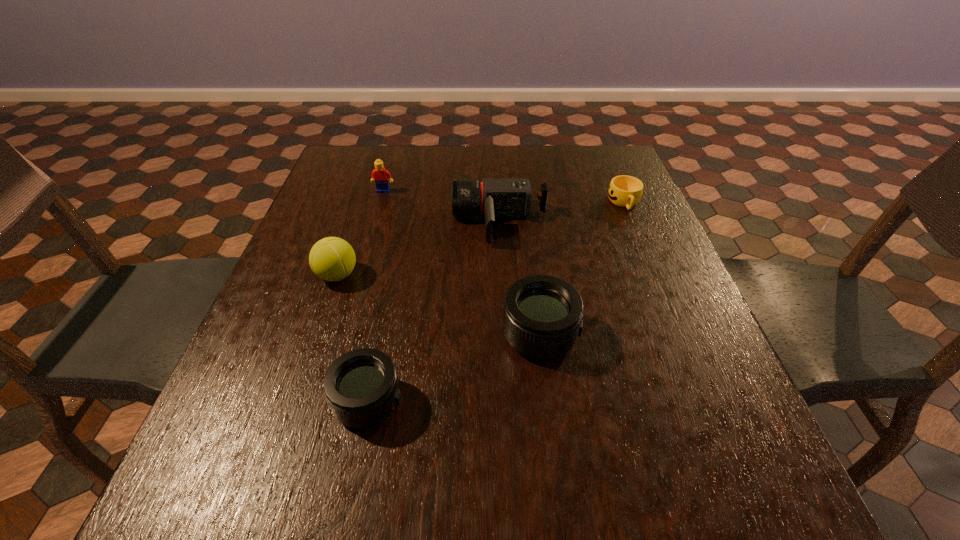
You are a GUI agent. You are given a task and a screenshot of the screen. Output one action in this format:
    pyautogui.click(x=<x>, y=<y>)
    Task: Click on the free location that satisfies the following two spatial constraints: 1. on the face of the rightmost object; 2. on the right side of the Lego
    
    Given the screenshot: What is the action you would take?
    pyautogui.click(x=380, y=203)

The height and width of the screenshot is (540, 960). What are the coordinates of `free space in the image that satisfies the following two spatial constraints: 1. on the face of the Lego; 2. on the left side of the shortest object` in the screenshot? It's located at (380, 203).